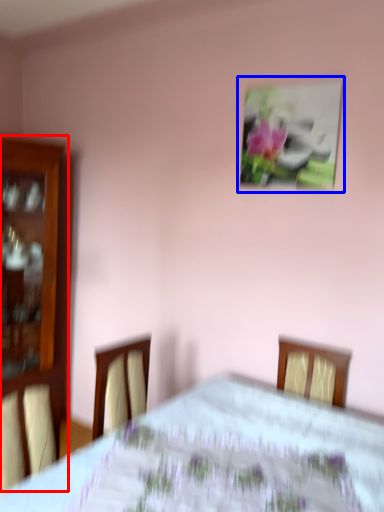
Question: Which object is further to the camera taking this photo, furniture (highlighted by a red box) or picture frame (highlighted by a blue box)?

Choices:
 (A) furniture
 (B) picture frame

Answer: (A)